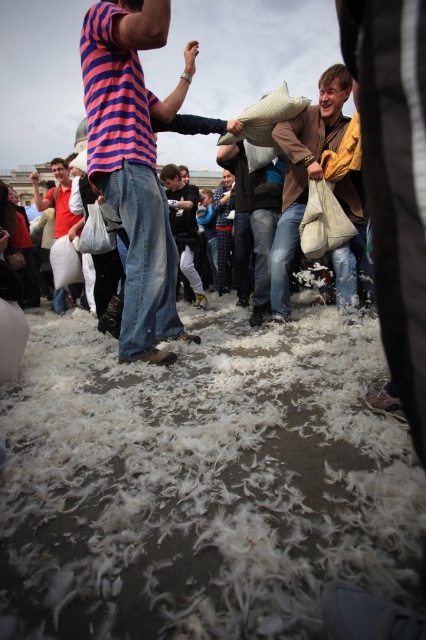
Describe the element at coordinates (184, 227) in the screenshot. This screenshot has height=640, width=426. I see `dark blue jeans at center` at that location.

Is dark blue jeans at center to the left of blue plaid shirt at center from the viewer's perspective?

Correct, you'll find dark blue jeans at center to the left of blue plaid shirt at center.

Identify the location of dark blue jeans at center. Image resolution: width=426 pixels, height=640 pixels. (184, 227).

Between point (187, 216) and point (57, 188), which one is positioned in front?

Point (57, 188)

Does dark blue jeans at center have a larger size compared to matte red shirt at left?

No.

The image size is (426, 640). Describe the element at coordinates (184, 227) in the screenshot. I see `dark blue jeans at center` at that location.

Identify the location of dark blue jeans at center. (184, 227).

Which is above, striped cotton shirt at center or blue plaid shirt at center?

blue plaid shirt at center

Locate an element on the screen. This screenshot has width=426, height=640. striped cotton shirt at center is located at coordinates (129, 152).

Who is more distant from viewer, (189, 74) or (227, 176)?

The point (227, 176) is more distant.

Locate an element on the screen. striped cotton shirt at center is located at coordinates (129, 152).